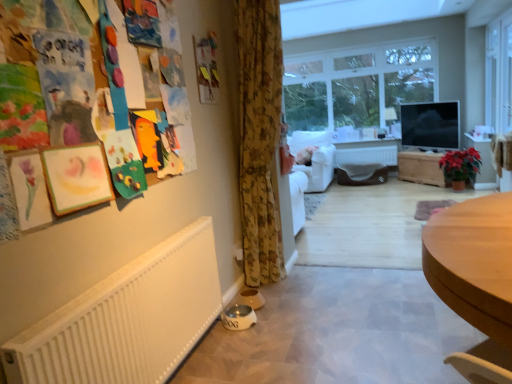
Where is `blank space situated above white matte radiator at center (from a real-world perspective)`? The image size is (512, 384). blank space situated above white matte radiator at center (from a real-world perspective) is located at coordinates (377, 143).